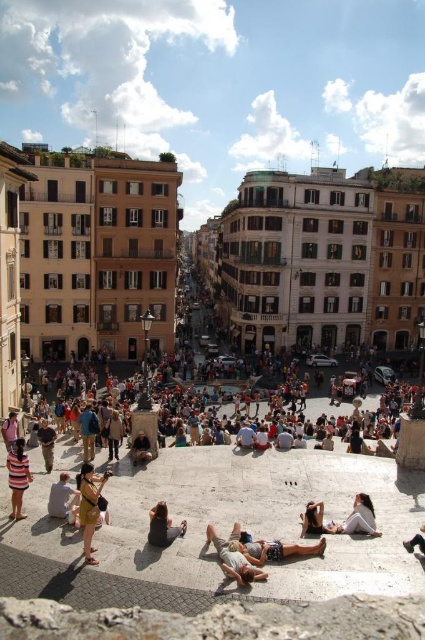
Question: Is matte gold necklace at lower center positioned in front of white fabric person at lower right?

Choices:
 (A) yes
 (B) no

Answer: (A)

Question: Among these objects, which one is farthest from the camera?

Choices:
 (A) light brown leather bag at lower left
 (B) leather shoe at lower right

Answer: (A)

Question: Is brown leather jacket at lower center positioned behind light brown leather jacket at center?

Choices:
 (A) no
 (B) yes

Answer: (A)

Question: Which point is closer to the camera?

Choices:
 (A) (42, 442)
 (B) (96, 433)
 (C) (413, 541)

Answer: (C)

Question: Estimate the real-world distances between objects in this image. Which object is closer to the matte gold necklace at lower center?

Choices:
 (A) light brown leather jacket at center
 (B) light brown leather person at center

Answer: (A)

Question: Is light brown leather bag at lower left further to camera compared to light brown leather jacket at center?

Choices:
 (A) no
 (B) yes

Answer: (A)